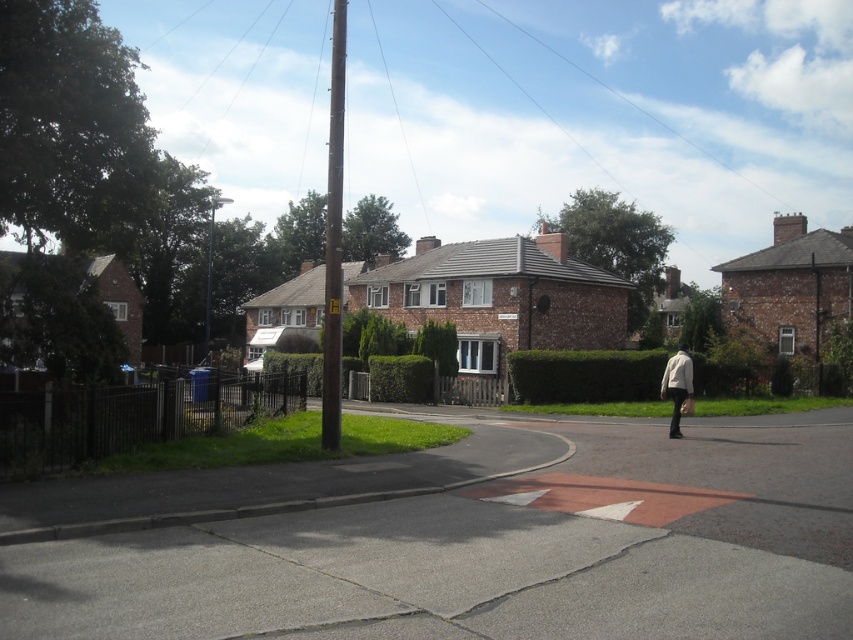
Is point (338, 10) farther from camera compared to point (683, 365)?

That is True.

Find the location of `brown wooden pole at center`. brown wooden pole at center is located at coordinates (334, 237).